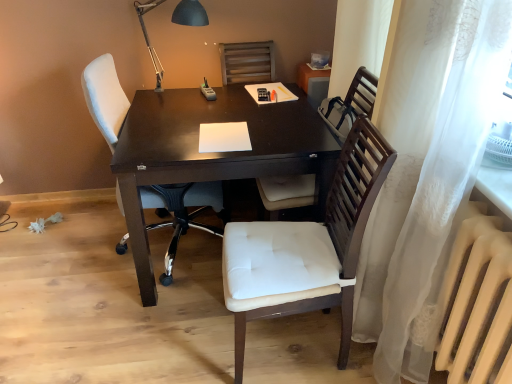
This screenshot has width=512, height=384. In order to click on free space to the back side of white paper at center in this screenshot , I will do `click(231, 110)`.